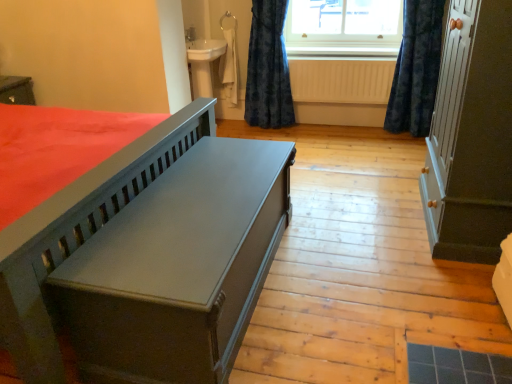
Question: Considering the relative sizes of matte gray cabinet at right and matte gray bench at center in the image provided, is matte gray cabinet at right wider than matte gray bench at center?

Choices:
 (A) no
 (B) yes

Answer: (B)

Question: Could you tell me if matte gray cabinet at right is facing matte gray bench at center?

Choices:
 (A) yes
 (B) no

Answer: (B)

Question: Can you confirm if matte gray cabinet at right is thinner than matte gray bench at center?

Choices:
 (A) yes
 (B) no

Answer: (B)

Question: Does matte gray cabinet at right have a lesser height compared to matte gray bench at center?

Choices:
 (A) no
 (B) yes

Answer: (A)

Question: From a real-world perspective, is matte gray cabinet at right beneath matte gray bench at center?

Choices:
 (A) yes
 (B) no

Answer: (B)

Question: Is matte gray cabinet at right touching matte gray bench at center?

Choices:
 (A) yes
 (B) no

Answer: (B)

Question: Can you confirm if dark blue velvet curtain at upper right, the 1th curtain in the right-to-left sequence, is smaller than wooden at upper center?

Choices:
 (A) no
 (B) yes

Answer: (A)

Question: From the image's perspective, is dark blue velvet curtain at upper right, marked as the 2th curtain in a left-to-right arrangement, above wooden at upper center?

Choices:
 (A) no
 (B) yes

Answer: (A)

Question: Is dark blue velvet curtain at upper right, the 1th curtain in the right-to-left sequence, wider than wooden at upper center?

Choices:
 (A) no
 (B) yes

Answer: (B)

Question: Considering the relative sizes of dark blue velvet curtain at upper right, the 1th curtain in the right-to-left sequence, and wooden at upper center in the image provided, is dark blue velvet curtain at upper right, the 1th curtain in the right-to-left sequence, bigger than wooden at upper center?

Choices:
 (A) no
 (B) yes

Answer: (B)

Question: Is dark blue velvet curtain at upper right, marked as the 2th curtain in a left-to-right arrangement, facing away from wooden at upper center?

Choices:
 (A) no
 (B) yes

Answer: (A)

Question: Considering the relative sizes of dark blue velvet curtain at upper right, marked as the 2th curtain in a left-to-right arrangement, and wooden at upper center in the image provided, is dark blue velvet curtain at upper right, marked as the 2th curtain in a left-to-right arrangement, shorter than wooden at upper center?

Choices:
 (A) yes
 (B) no

Answer: (B)

Question: Would you say matte gray bench at center is part of dark blue velvet curtain at upper right, the 1th curtain in the right-to-left sequence,'s contents?

Choices:
 (A) yes
 (B) no

Answer: (B)